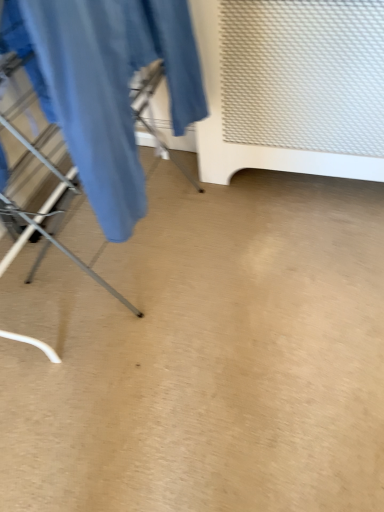
Question: Is matte blue fabric at left oriented away from white textured radiator at upper right?

Choices:
 (A) no
 (B) yes

Answer: (A)

Question: Does matte blue fabric at left have a larger size compared to white textured radiator at upper right?

Choices:
 (A) no
 (B) yes

Answer: (A)

Question: Is matte blue fabric at left thinner than white textured radiator at upper right?

Choices:
 (A) yes
 (B) no

Answer: (A)

Question: Does matte blue fabric at left have a smaller size compared to white textured radiator at upper right?

Choices:
 (A) yes
 (B) no

Answer: (A)

Question: Is matte blue fabric at left in contact with white textured radiator at upper right?

Choices:
 (A) no
 (B) yes

Answer: (A)

Question: Is matte blue fabric at left not close to white textured radiator at upper right?

Choices:
 (A) yes
 (B) no

Answer: (B)

Question: Is white textured radiator at upper right turned away from matte blue fabric at left?

Choices:
 (A) yes
 (B) no

Answer: (B)

Question: Can you confirm if white textured radiator at upper right is wider than matte blue fabric at left?

Choices:
 (A) no
 (B) yes

Answer: (B)

Question: Does white textured radiator at upper right lie behind matte blue fabric at left?

Choices:
 (A) no
 (B) yes

Answer: (B)

Question: Considering the relative sizes of white textured radiator at upper right and matte blue fabric at left in the image provided, is white textured radiator at upper right smaller than matte blue fabric at left?

Choices:
 (A) yes
 (B) no

Answer: (B)

Question: Is white textured radiator at upper right bigger than matte blue fabric at left?

Choices:
 (A) no
 (B) yes

Answer: (B)

Question: Is white textured radiator at upper right taller than matte blue fabric at left?

Choices:
 (A) yes
 (B) no

Answer: (A)

Question: From the image's perspective, is white textured radiator at upper right above or below matte blue fabric at left?

Choices:
 (A) below
 (B) above

Answer: (B)